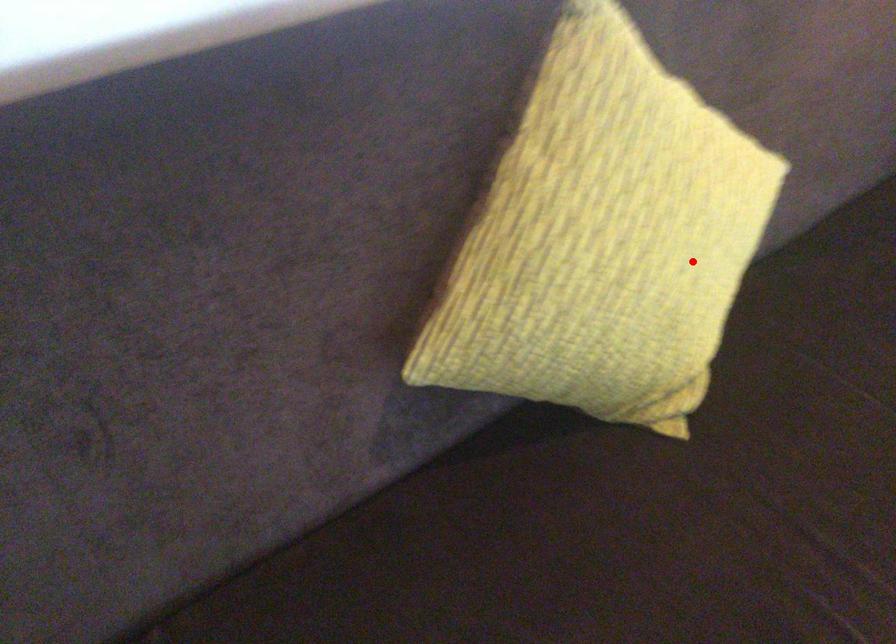
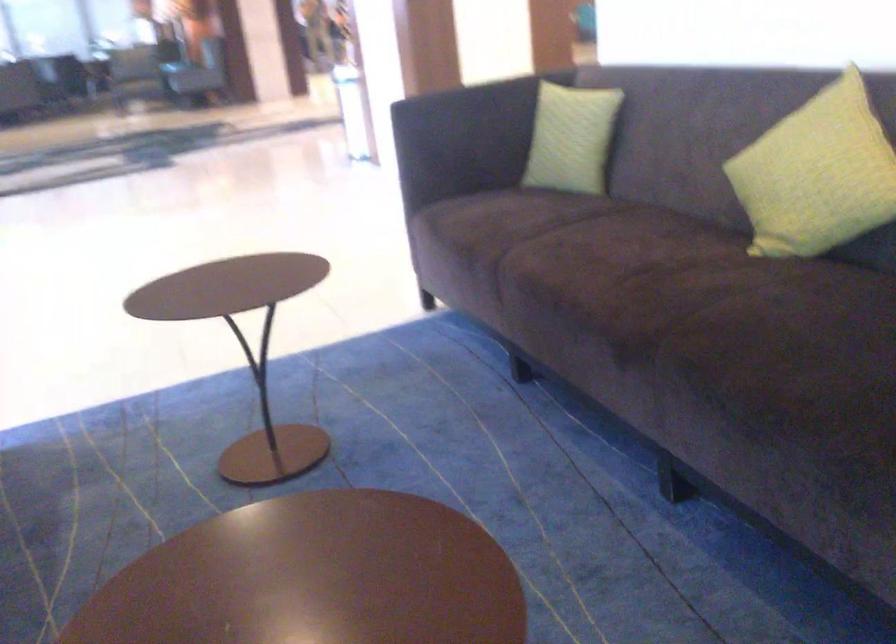
Locate, in the second image, the point that corresponds to the highlighted location in the first image.

(816, 174)